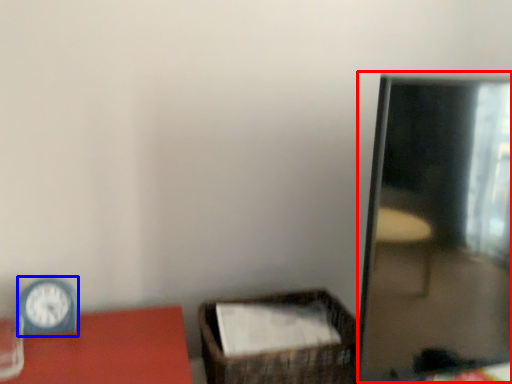
Question: Which of the following is the closest to the observer, mirror (highlighted by a red box) or clock (highlighted by a blue box)?

Choices:
 (A) mirror
 (B) clock

Answer: (A)